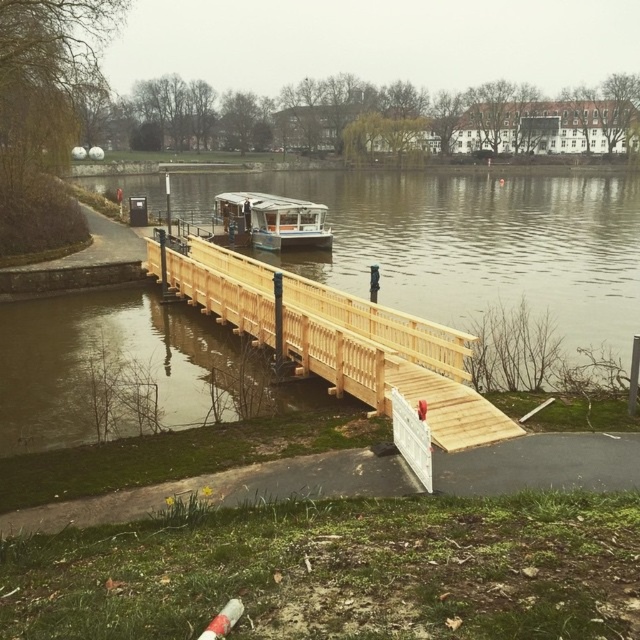
Measure the distance between point (360, 259) and camera.

The distance of point (360, 259) from camera is 31.00 meters.

Which is more to the right, brown wooden bridge at center or natural wood bridge at center?

From the viewer's perspective, brown wooden bridge at center appears more on the right side.

Measure the distance between point (518, 227) and camera.

Point (518, 227) is 142.77 feet from camera.

The image size is (640, 640). What are the coordinates of `brown wooden bridge at center` in the screenshot? It's located at (468, 243).

Describe the element at coordinates (468, 243) in the screenshot. I see `brown wooden bridge at center` at that location.

Describe the element at coordinates (468, 243) in the screenshot. I see `brown wooden bridge at center` at that location.

At what (x,y) coordinates should I click in order to perform the action: click on brown wooden bridge at center. Please return your answer as a coordinate pair (x, y). Looking at the image, I should click on (468, 243).

Is natural wood bridge at center shorter than green plastic boat at center?

Incorrect, natural wood bridge at center's height does not fall short of green plastic boat at center's.

Is natural wood bridge at center below green plastic boat at center?

Yes.

Locate an element on the screen. The image size is (640, 640). natural wood bridge at center is located at coordinates (342, 339).